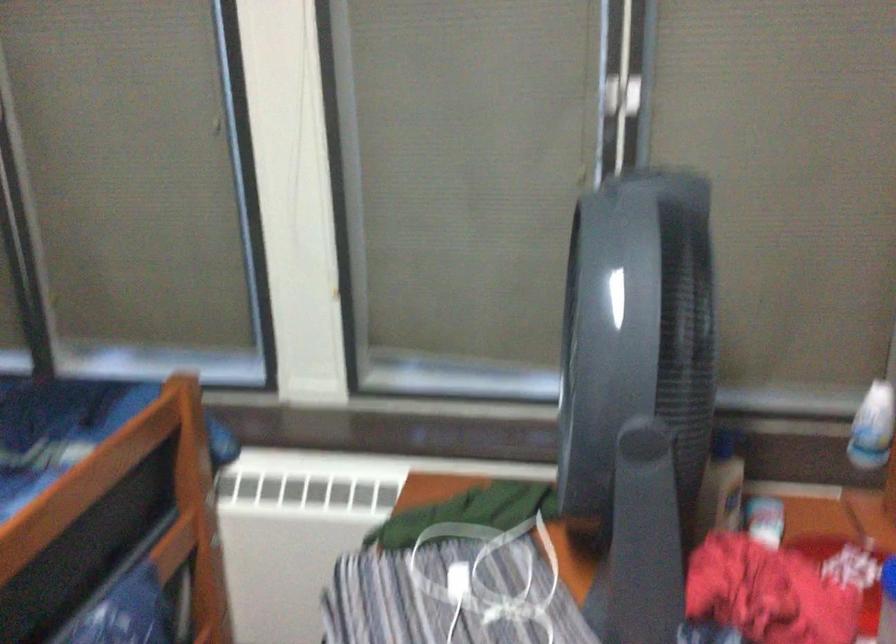
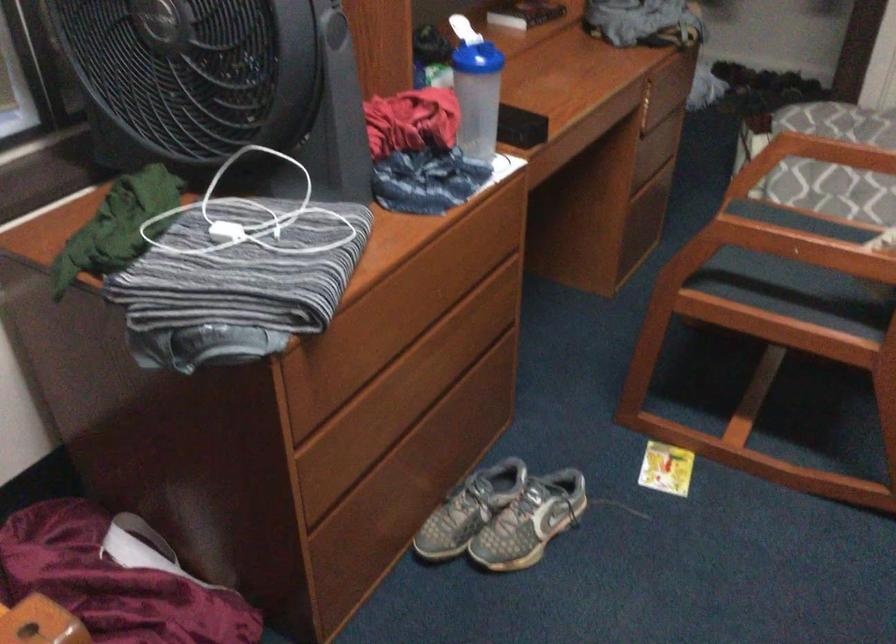
Locate, in the second image, the point that corresponds to [514,576] in the first image.

(250, 216)